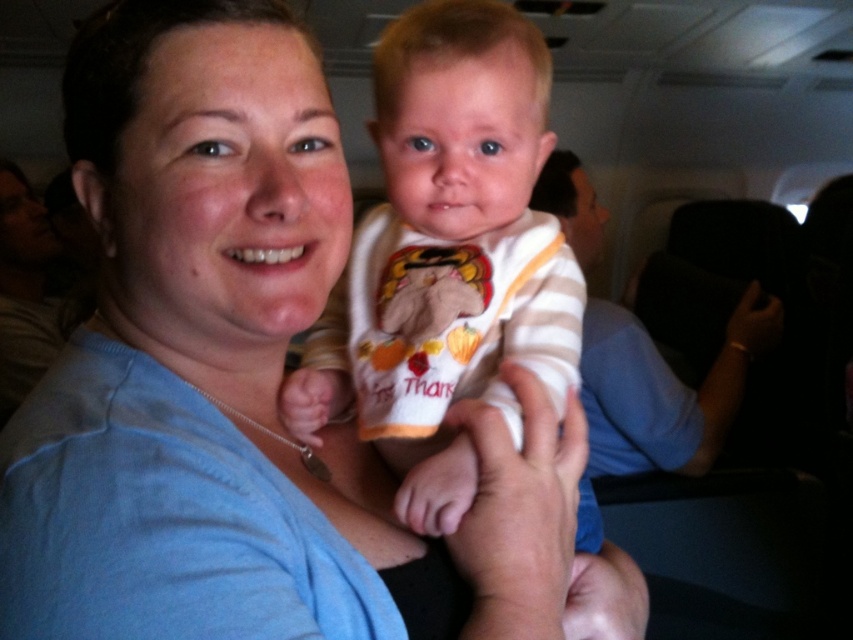
Who is positioned more to the left, white striped onesie at center or striped fabric baby at center?

Positioned to the left is white striped onesie at center.

Measure the distance between white striped onesie at center and striped fabric baby at center.

The distance of white striped onesie at center from striped fabric baby at center is 33.55 inches.

Locate an element on the screen. The image size is (853, 640). white striped onesie at center is located at coordinates tap(451, 163).

Does blue cotton shirt at center appear under striped fabric baby at center?

Actually, blue cotton shirt at center is above striped fabric baby at center.

Who is taller, blue cotton shirt at center or striped fabric baby at center?

Standing taller between the two is blue cotton shirt at center.

Describe the element at coordinates (236, 378) in the screenshot. I see `blue cotton shirt at center` at that location.

Find the location of a particular element. The width and height of the screenshot is (853, 640). blue cotton shirt at center is located at coordinates (236, 378).

Is blue cotton shirt at center to the left of white striped onesie at center from the viewer's perspective?

Yes, blue cotton shirt at center is to the left of white striped onesie at center.

The height and width of the screenshot is (640, 853). What do you see at coordinates (236, 378) in the screenshot? I see `blue cotton shirt at center` at bounding box center [236, 378].

You are a GUI agent. You are given a task and a screenshot of the screen. Output one action in this format:
    pyautogui.click(x=<x>, y=<y>)
    Task: Click on the blue cotton shirt at center
    The image size is (853, 640).
    Given the screenshot: What is the action you would take?
    pyautogui.click(x=236, y=378)